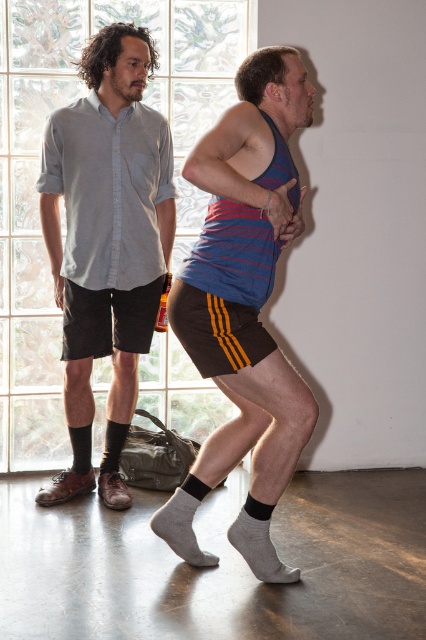
Question: Is gray wool sock at lower center below gray cotton sock at lower center?

Choices:
 (A) no
 (B) yes

Answer: (A)

Question: Which object appears closest to the camera in this image?

Choices:
 (A) gray cotton sock at lower center
 (B) matte gray shirt at left

Answer: (A)

Question: Which object appears closest to the camera in this image?

Choices:
 (A) striped cotton tank top at center
 (B) gray cotton sock at lower center

Answer: (A)

Question: Estimate the real-world distances between objects in this image. Which object is closer to the gray cotton sock at lower center?

Choices:
 (A) black cotton sock at lower left
 (B) gray wool sock at lower center
 (C) striped cotton tank top at center

Answer: (B)

Question: Is black cotton sock at lower left to the left of black matte sock at lower left from the viewer's perspective?

Choices:
 (A) yes
 (B) no

Answer: (B)

Question: From the image, what is the correct spatial relationship of matte gray shirt at left in relation to black matte sock at lower left?

Choices:
 (A) above
 (B) below

Answer: (A)